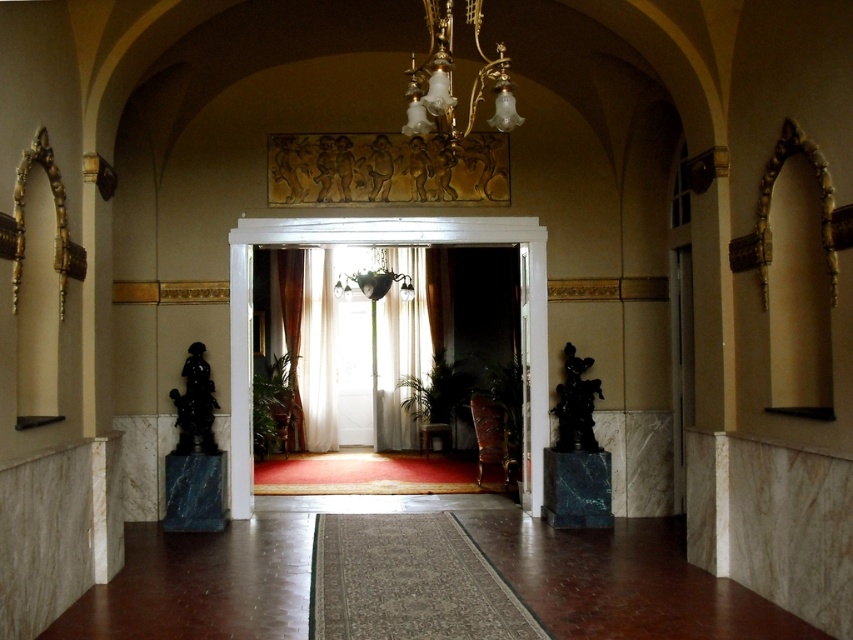
Question: Does matte white door at center lie in front of gold/brass chandelier at upper center?

Choices:
 (A) no
 (B) yes

Answer: (A)

Question: Is matte white door at center positioned at the back of gold/brass chandelier at upper center?

Choices:
 (A) no
 (B) yes

Answer: (B)

Question: Which point is farther to the camera?

Choices:
 (A) matte white door at center
 (B) gold/brass chandelier at upper center

Answer: (A)

Question: Does matte white door at center appear on the left side of gold/brass chandelier at upper center?

Choices:
 (A) no
 (B) yes

Answer: (A)